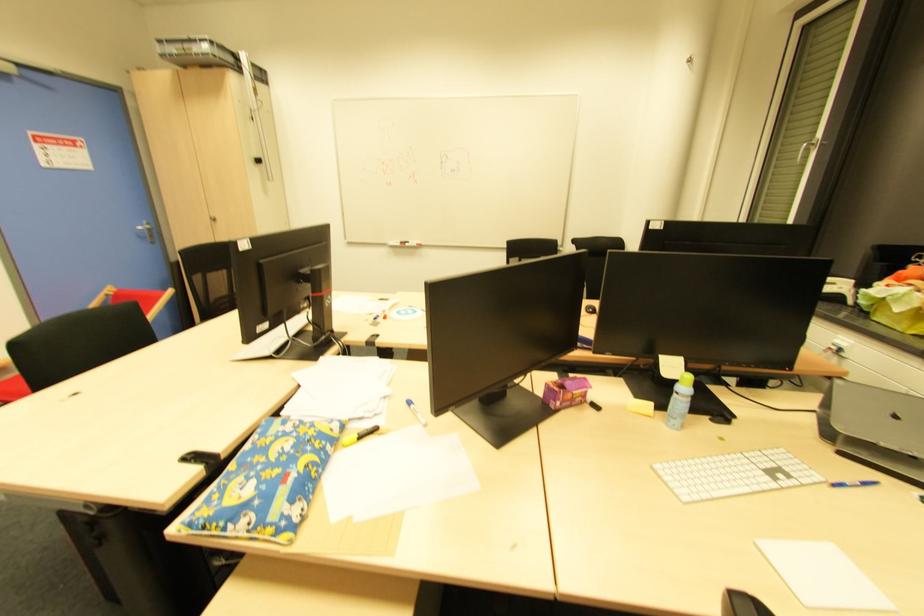
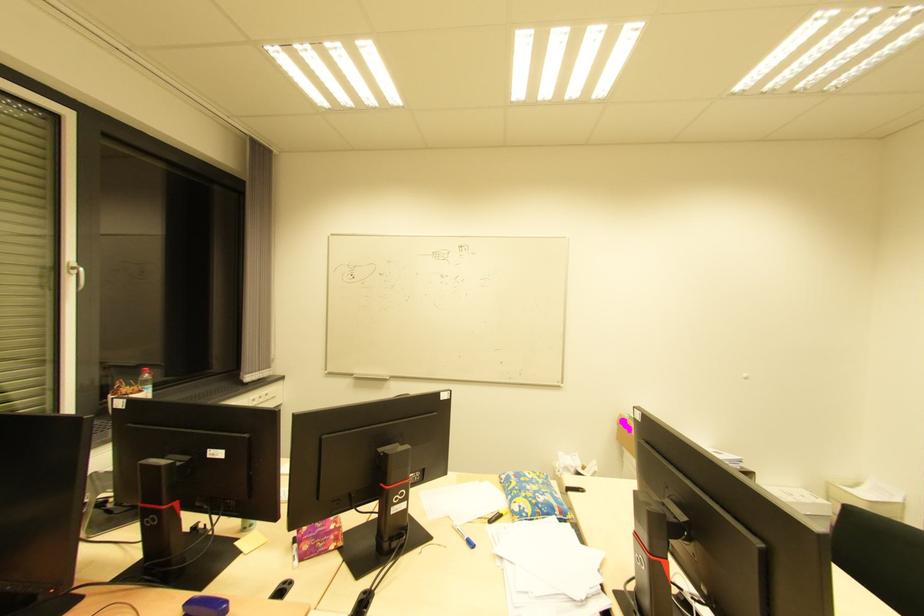
Locate, in the second image, the point that corresponds to (409,406) in the first image.

(470, 546)